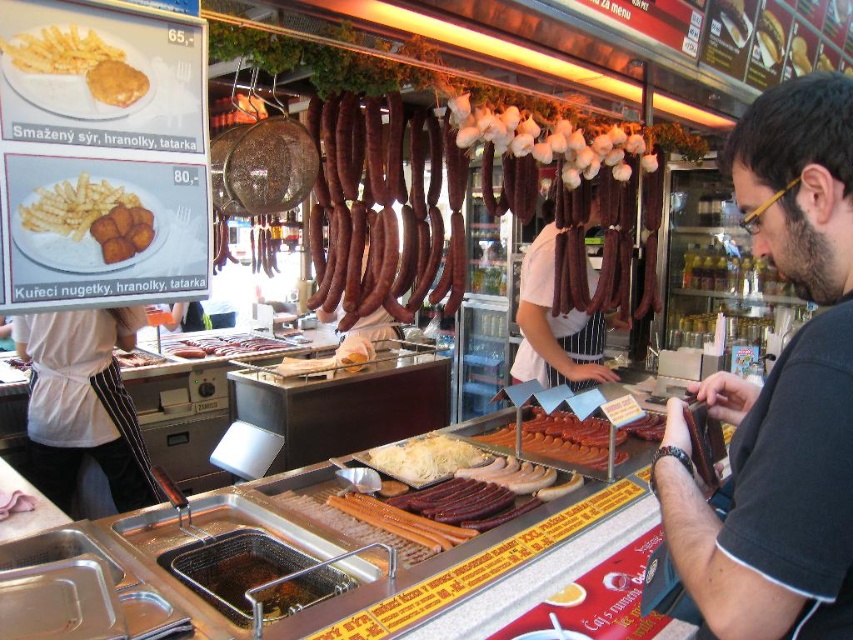
You are a customer at the food stall and want to order the matte brown sausage at center and the matte brown nugget at center. Which item is positioned to the right of the other?

The matte brown sausage at center is to the right of the matte brown nugget at center.

You are a customer at the food stall and see both the dark brown leather wallet at center right and the shiny metal sausage at center. Which item is located more to the right?

The dark brown leather wallet at center right is positioned on the right side of the shiny metal sausage at center, so it is more to the right.

You are a customer at the food stall and want to order the largest item available. Which item should you choose between the matte brown sausage at center and the matte brown nugget at center?

The matte brown sausage at center is bigger than the matte brown nugget at center, so you should choose the matte brown sausage at center.